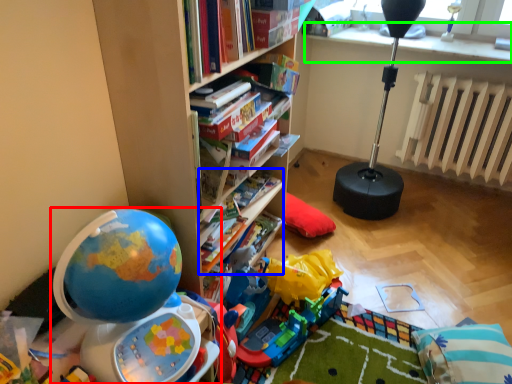
Question: Considering the real-world distances, which object is farthest from toy (highlighted by a red box)? book (highlighted by a blue box) or window sill (highlighted by a green box)?

Choices:
 (A) book
 (B) window sill

Answer: (B)